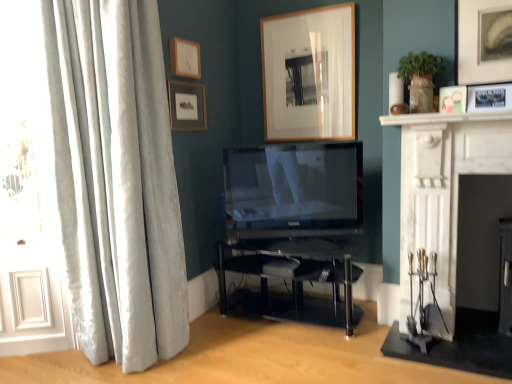
Find the location of a particular element. empty space that is ontop of wooden picture frame at upper center, which ranks as the third picture frame in left-to-right order (from a real-world perspective) is located at coordinates (300, 10).